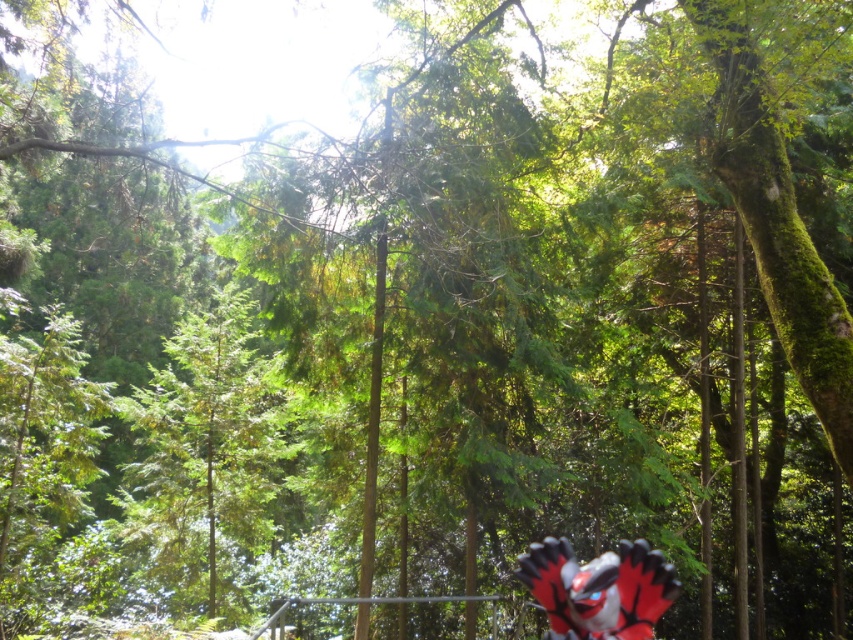
Is green textured tree at center smaller than red and black plush toy at bottom right?

Yes.

Is green textured tree at center to the right of red and black plush toy at bottom right from the viewer's perspective?

Incorrect, green textured tree at center is not on the right side of red and black plush toy at bottom right.

Between point (236, 332) and point (547, 554), which one is positioned behind?

Positioned behind is point (236, 332).

Locate an element on the screen. green textured tree at center is located at coordinates point(204,454).